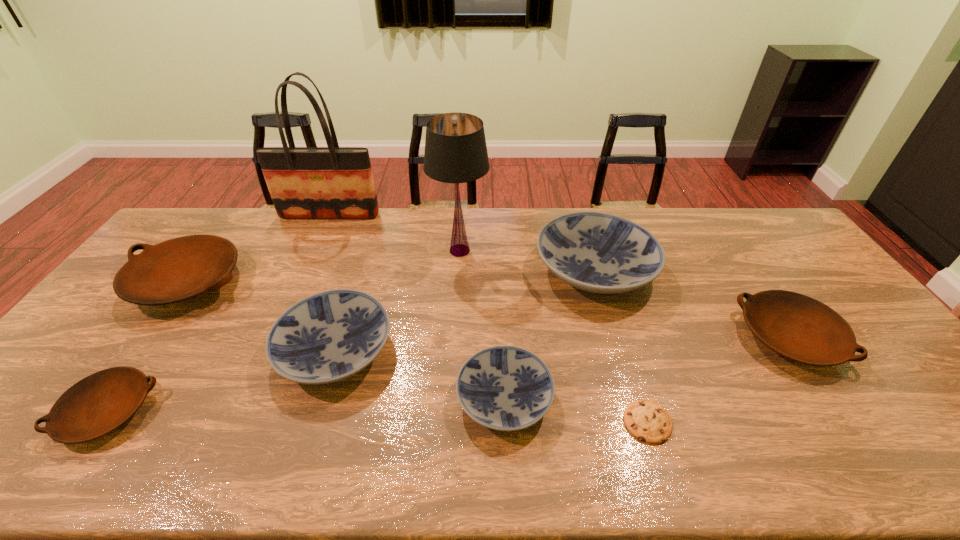
Find the location of `the smallest blue plate`. the smallest blue plate is located at coordinates (506, 388).

The height and width of the screenshot is (540, 960). Identify the location of the eighth tallest object. (100, 403).

Find the location of a particular element. The height and width of the screenshot is (540, 960). the smallest brown plate is located at coordinates (100, 403).

Locate an element on the screen. Image resolution: width=960 pixels, height=540 pixels. cookie is located at coordinates (646, 420).

Where is `free space located on the front-facing side of the shopping bag`? The width and height of the screenshot is (960, 540). free space located on the front-facing side of the shopping bag is located at coordinates (293, 297).

The image size is (960, 540). I want to click on vacant space situated on the front-facing side of the lampshade, so click(x=512, y=251).

Find the location of a particular element. free spot located on the left of the second plate from right to left is located at coordinates (486, 270).

Locate an element on the screen. vacant area located on the front of the biggest brown plate is located at coordinates (126, 368).

Locate an element on the screen. vacant space situated on the left of the second biggest blue plate is located at coordinates (129, 351).

Locate an element on the screen. The height and width of the screenshot is (540, 960). vacant space located 0.090m on the back of the second smallest brown plate is located at coordinates (753, 283).